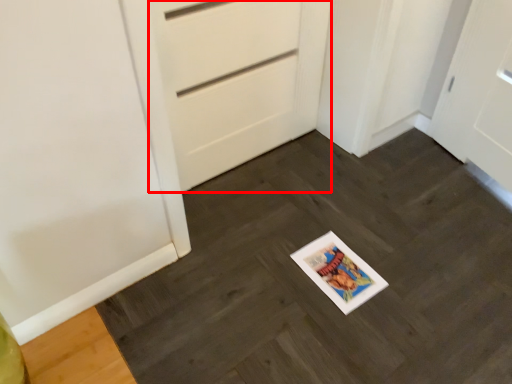
Question: From the image's perspective, where is door (annotated by the red box) located in relation to slate in the image?

Choices:
 (A) above
 (B) below

Answer: (A)